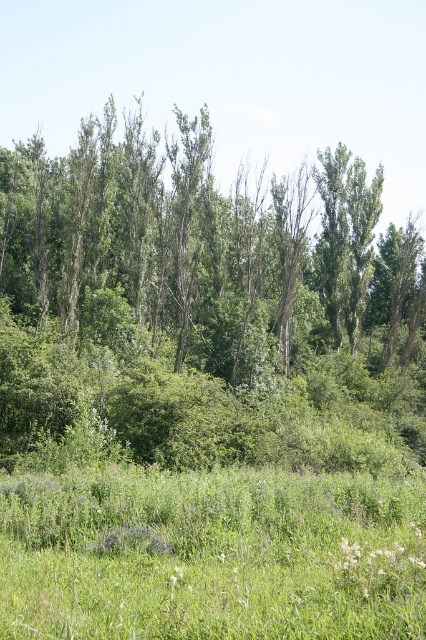
Question: Among these points, which one is farthest from the camera?

Choices:
 (A) (146, 147)
 (B) (356, 486)
 (C) (359, 173)

Answer: (A)

Question: In this image, where is green leafy forest at center located relative to green leafy tree at upper center?

Choices:
 (A) below
 (B) above

Answer: (B)

Question: From the image, what is the correct spatial relationship of green leafy forest at center in relation to green leafy tree at upper center?

Choices:
 (A) right
 (B) left

Answer: (B)

Question: Which is nearer to the green leafy forest at center?

Choices:
 (A) green leafy tree at upper center
 (B) green grassy field at lower center

Answer: (A)

Question: Which point appears closest to the camera in this image?

Choices:
 (A) (287, 472)
 (B) (302, 333)

Answer: (A)

Question: Is green leafy forest at center thinner than green grassy field at lower center?

Choices:
 (A) yes
 (B) no

Answer: (B)